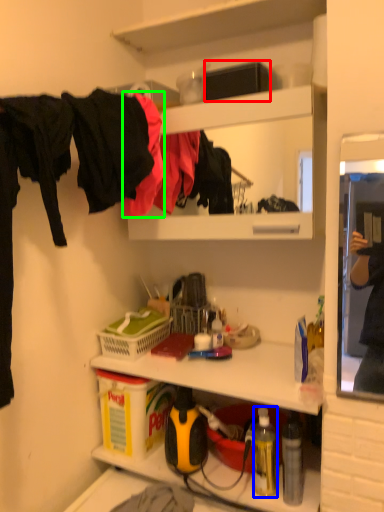
Question: Which object is positioned farthest from box (highlighted by a red box)? Select from bottle (highlighted by a blue box) and clothing (highlighted by a green box).

Choices:
 (A) bottle
 (B) clothing

Answer: (A)